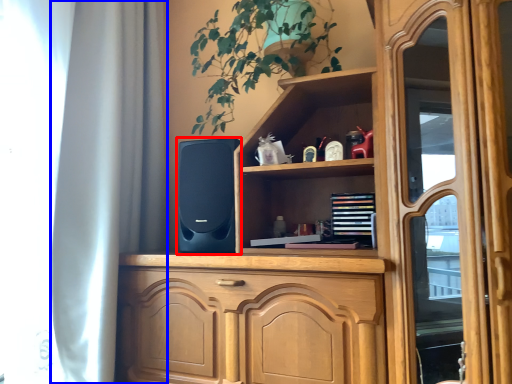
Question: Which point is further to the camera, speaker (highlighted by a red box) or curtain (highlighted by a blue box)?

Choices:
 (A) speaker
 (B) curtain

Answer: (A)